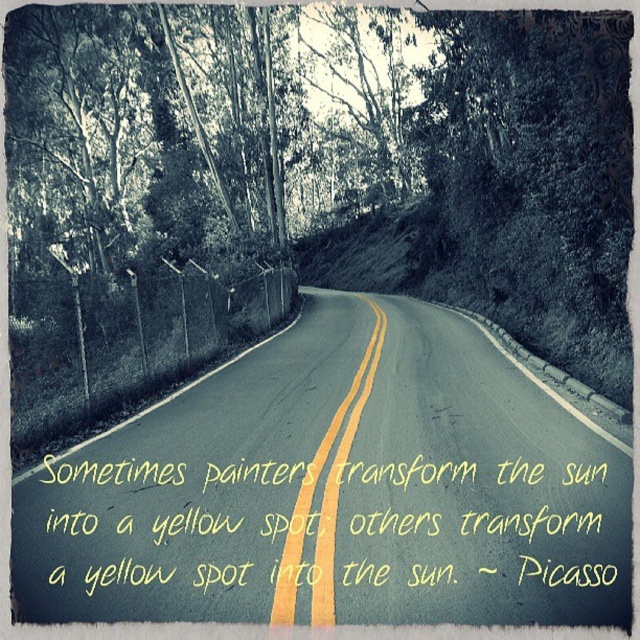
Can you confirm if yellow asphalt road at center is wider than yellow painted lines at center?

Correct, the width of yellow asphalt road at center exceeds that of yellow painted lines at center.

Which is below, yellow asphalt road at center or yellow painted lines at center?

yellow asphalt road at center is below.

Identify the location of yellow asphalt road at center. (339, 490).